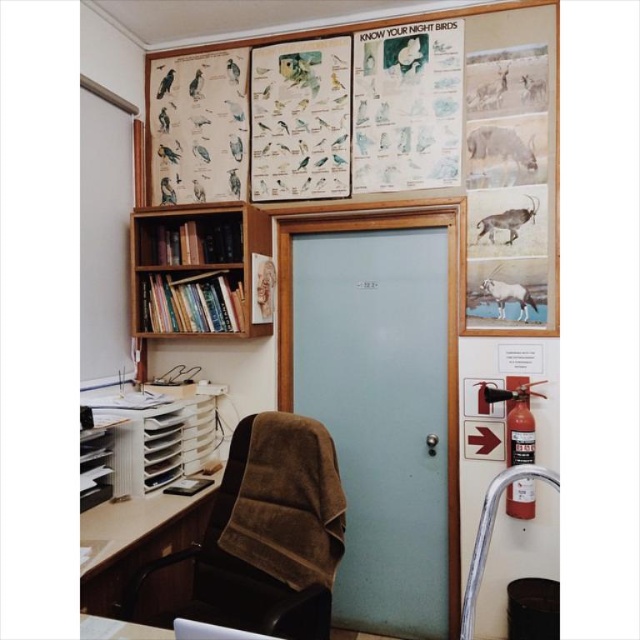
Based on the photo, you are standing at the center of the room and want to move to the light brown wood desk at lower left. In which direction should you move?

You should move to the lower left direction to reach the light brown wood desk at lower left.

You are organizing a small exhibition in the office corner shown. You need to place a new poster between the wooden bookshelf at left and the white textured antelope at upper right. Based on their positions, which object should the poster be closer to?

The poster should be placed closer to the white textured antelope at upper right since the wooden bookshelf at left is positioned to the left of it, meaning the antelope is further to the right.